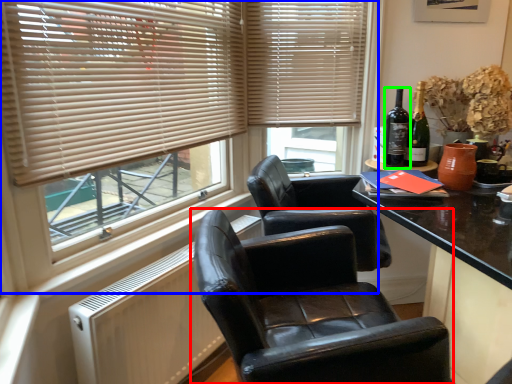
Question: Estimate the real-world distances between objects in this image. Which object is closer to chair (highlighted by a red box), window (highlighted by a blue box) or bottle (highlighted by a green box)?

Choices:
 (A) window
 (B) bottle

Answer: (A)